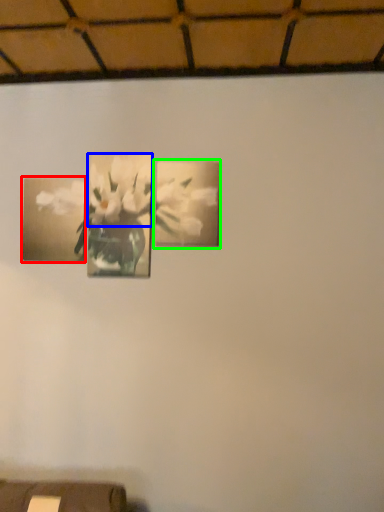
Question: Which object is the farthest from picture frame (highlighted by a red box)? Choose among these: flower (highlighted by a blue box) or picture frame (highlighted by a green box).

Choices:
 (A) flower
 (B) picture frame

Answer: (B)